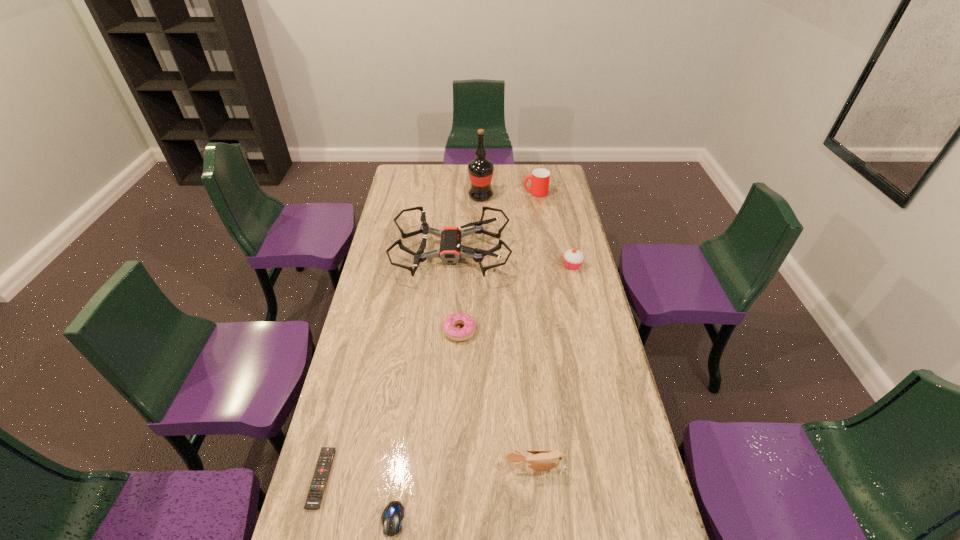
The height and width of the screenshot is (540, 960). In order to click on free space that satisfies the following two spatial constraints: 1. on the back side of the remote control; 2. on the side of the cup with the handle in this screenshot , I will do `click(396, 193)`.